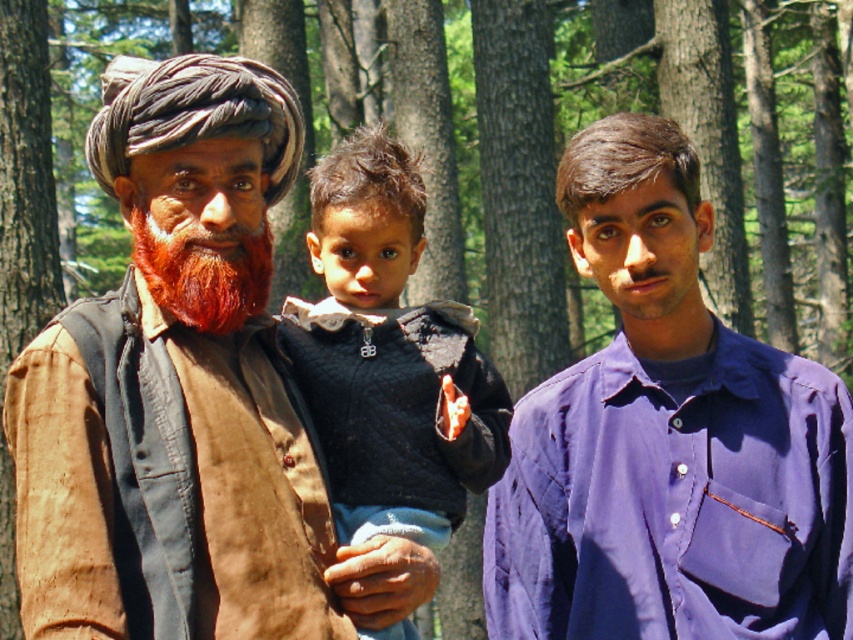
Question: Which object appears farthest from the camera in this image?

Choices:
 (A) purple cotton shirt at center
 (B) reddish-brown textured beard at center
 (C) dark blue sweater at center

Answer: (A)

Question: Which object is the closest to the reddish-brown textured beard at center?

Choices:
 (A) purple cotton shirt at center
 (B) dark blue sweater at center

Answer: (A)

Question: Is purple cotton shirt at center below reddish-brown textured beard at center?

Choices:
 (A) yes
 (B) no

Answer: (A)

Question: Can you confirm if purple cotton shirt at center is smaller than reddish-brown textured beard at center?

Choices:
 (A) no
 (B) yes

Answer: (A)

Question: Based on their relative distances, which object is nearer to the reddish-brown textured beard at center?

Choices:
 (A) purple cotton shirt at center
 (B) dark blue sweater at center

Answer: (A)

Question: Considering the relative positions of dark blue sweater at center and reddish-brown textured beard at center in the image provided, where is dark blue sweater at center located with respect to reddish-brown textured beard at center?

Choices:
 (A) left
 (B) right

Answer: (B)